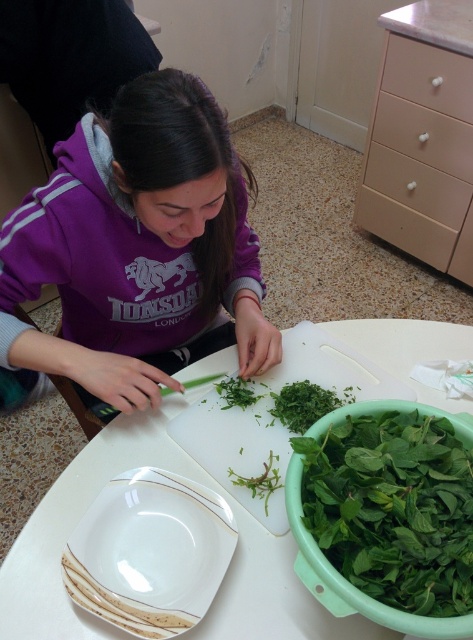
Is purple fleece hoodie at center closer to camera compared to beige wood drawer at upper right?

Yes, it is.

Who is higher up, purple fleece hoodie at center or beige wood drawer at upper right?

beige wood drawer at upper right is higher up.

Is point (201, 355) behind point (385, 204)?

No, it is not.

Where is `purple fleece hoodie at center`? This screenshot has height=640, width=473. purple fleece hoodie at center is located at coordinates (139, 248).

Is point (140, 253) positioned behind point (380, 413)?

Yes, it is.

Identify the location of purple fleece hoodie at center. The width and height of the screenshot is (473, 640). (139, 248).

Between point (8, 305) and point (193, 588), which one is positioned in front?

Point (193, 588)

Between purple fleece hoodie at center and white glossy plate at lower left, which one is positioned higher?

purple fleece hoodie at center is higher up.

Find the location of a particular element. This screenshot has width=473, height=640. purple fleece hoodie at center is located at coordinates (139, 248).